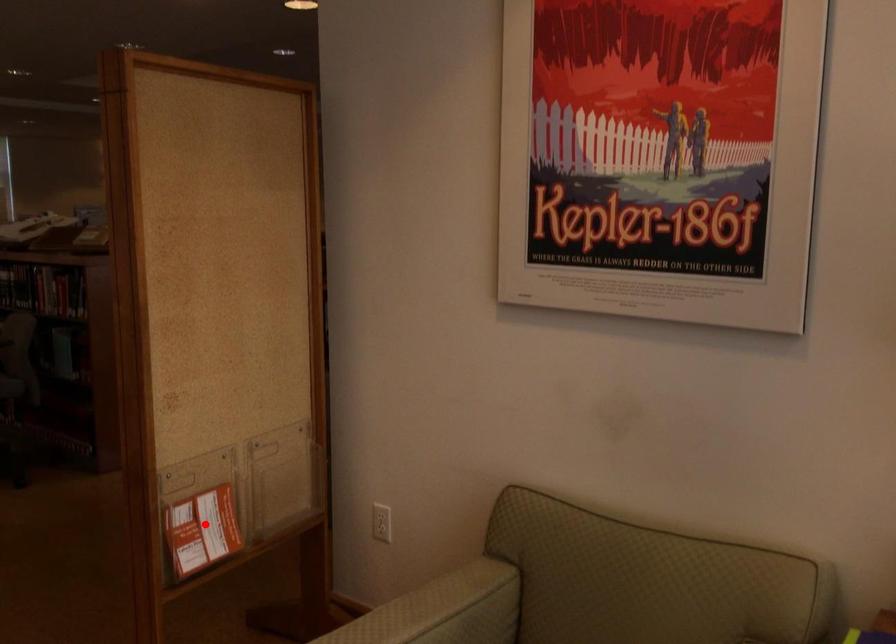
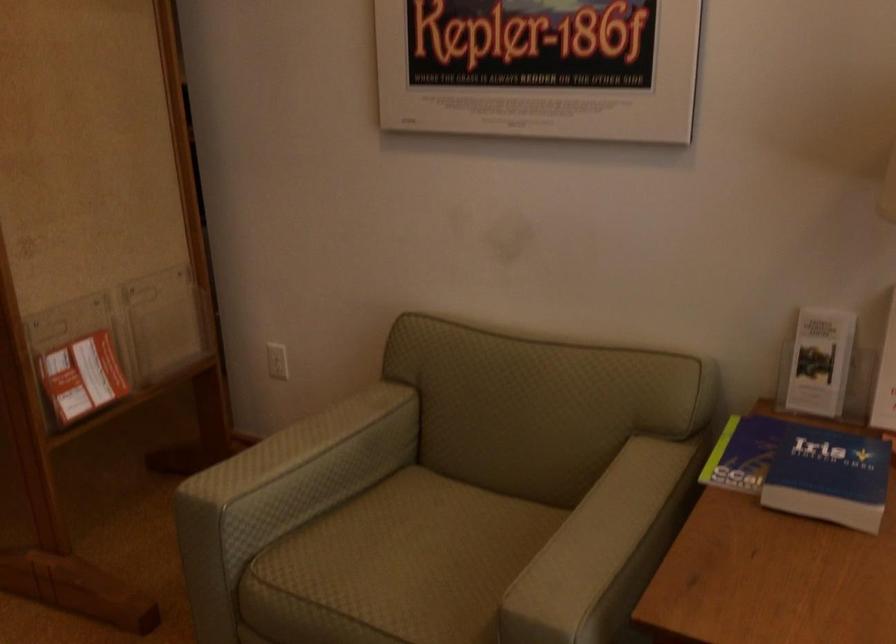
Where in the second image is the point corresponding to the highlighted location from the first image?

(82, 377)